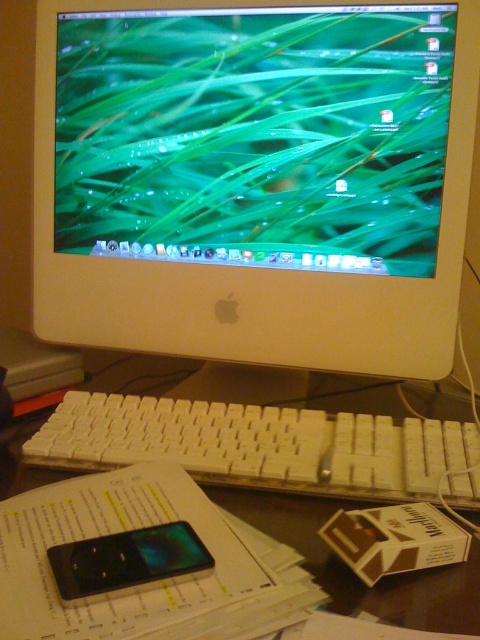
You are setting up a desk and need to place two white plastic keyboards. According to the image, where should you position the white plastic keyboard at center relative to the white plastic keyboard at lower center?

The white plastic keyboard at center should be placed to the left of the white plastic keyboard at lower center.

You are sitting at the workspace shown in the image. You need to reach for the white plastic monitor at center to adjust its settings. Considering your arm length is 70 cm, can you comfortably reach it without moving your chair?

The white plastic monitor at center is 21.77 inches away from the viewer. Since 21.77 inches is approximately 55 cm, and your arm length is 70 cm, you can comfortably reach it without moving your chair.

You are setting up a desk and want to place a new mouse between the white plastic keyboard at center and the white plastic keyboard at lower center. According to the current setup, is there enough space between them to place the mouse?

The white plastic keyboard at lower center is behind the white plastic keyboard at center, so there is no space between them to place the mouse.